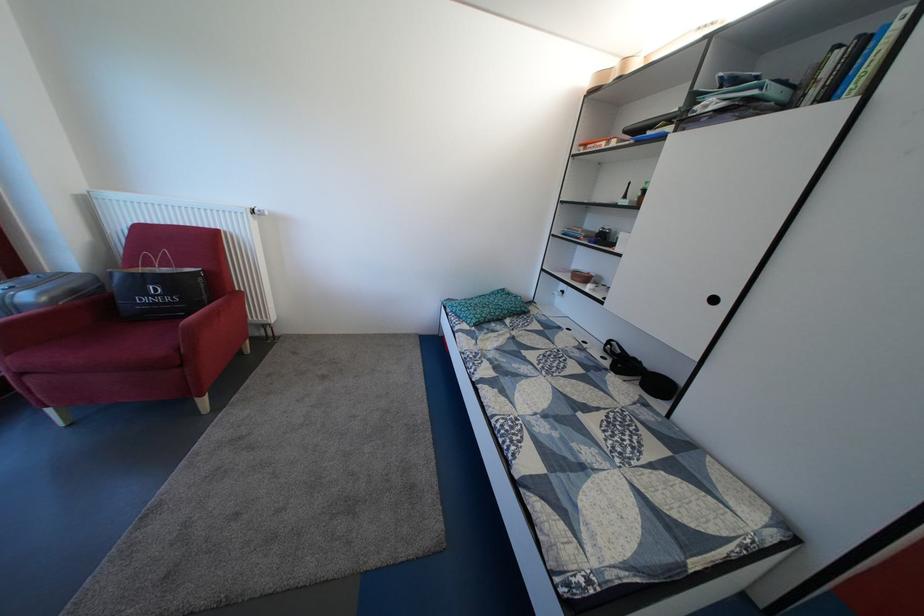
I want to click on recessed cabinet handle, so click(x=564, y=294).